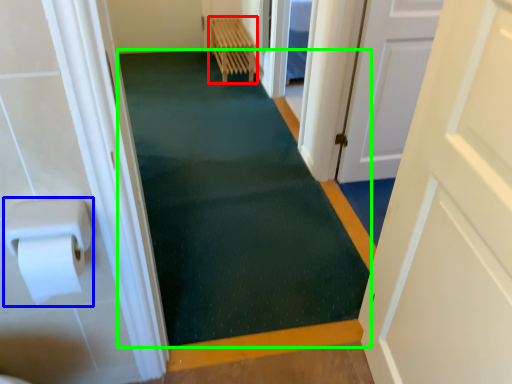
Question: Which object is positioned farthest from furniture (highlighted by a red box)? Select from paper towel (highlighted by a blue box) and bath mat (highlighted by a green box).

Choices:
 (A) paper towel
 (B) bath mat

Answer: (A)